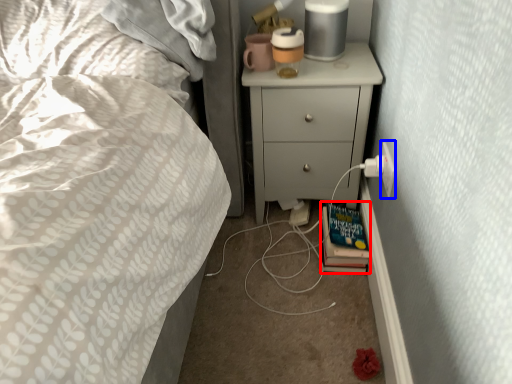
Question: Which of the following is the farthest to the observer, book (highlighted by a red box) or electric outlet (highlighted by a blue box)?

Choices:
 (A) book
 (B) electric outlet

Answer: (A)